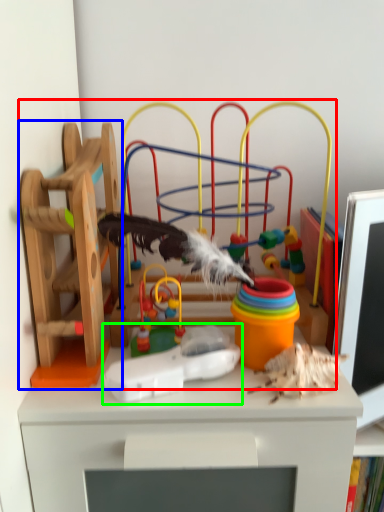
Question: Considering the real-world distances, which object is closest to toy (highlighted by a red box)? toy (highlighted by a blue box) or toy (highlighted by a green box).

Choices:
 (A) toy
 (B) toy

Answer: (A)